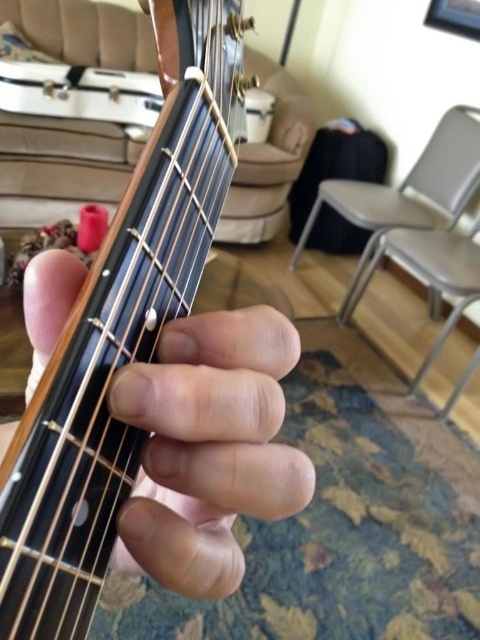
Question: From the image, what is the correct spatial relationship of wooden acoustic guitar at center in relation to wooden guitar neck at center?

Choices:
 (A) below
 (B) above

Answer: (B)

Question: Can you confirm if wooden acoustic guitar at center is thinner than wooden guitar neck at center?

Choices:
 (A) no
 (B) yes

Answer: (B)

Question: In this image, where is wooden acoustic guitar at center located relative to wooden guitar neck at center?

Choices:
 (A) left
 (B) right

Answer: (B)

Question: Which of the following is the farthest from the observer?

Choices:
 (A) wooden guitar neck at center
 (B) wooden acoustic guitar at center

Answer: (A)

Question: Which of the following is the farthest from the observer?

Choices:
 (A) (132, 570)
 (B) (106, 394)

Answer: (A)

Question: Which point appears farthest from the camera in this image?

Choices:
 (A) pyautogui.click(x=214, y=131)
 (B) pyautogui.click(x=49, y=257)

Answer: (A)